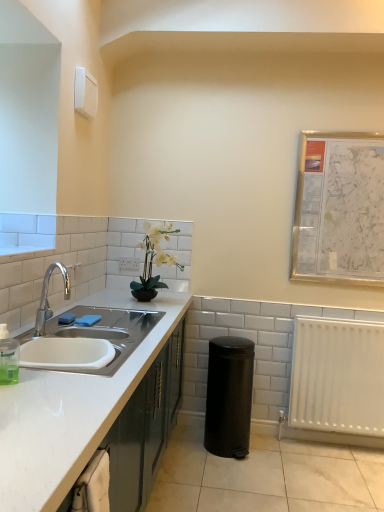
Question: From the image's perspective, is white matte cabinet at left located above or below white matte radiator at lower right?

Choices:
 (A) below
 (B) above

Answer: (A)

Question: Looking at their shapes, would you say white matte cabinet at left is wider or thinner than white matte radiator at lower right?

Choices:
 (A) wide
 (B) thin

Answer: (A)

Question: Which of these objects is positioned closest to the translucent plastic soap dispenser at sink left?

Choices:
 (A) white matte cabinet at left
 (B) white glossy sink at left
 (C) black matte trash can at lower right
 (D) blue sponge at sink left
 (E) white plastic electric outlet at upper center

Answer: (B)

Question: Considering the real-world distances, which object is farthest from the black matte trash can at lower right?

Choices:
 (A) white matte vase at center
 (B) silver metallic map at upper right
 (C) white glossy sink at left
 (D) blue sponge at sink left
 (E) white matte cabinet at left

Answer: (D)